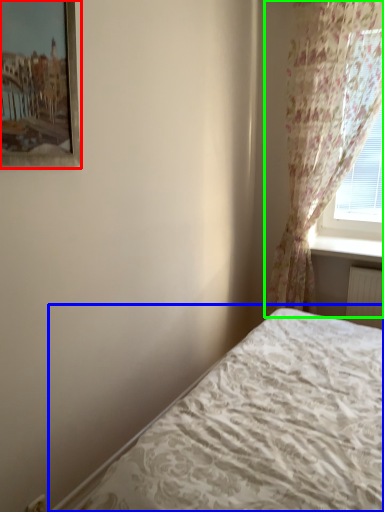
Question: Which is farther away from picture frame (highlighted by a red box)? bed (highlighted by a blue box) or curtain (highlighted by a green box)?

Choices:
 (A) bed
 (B) curtain

Answer: (B)